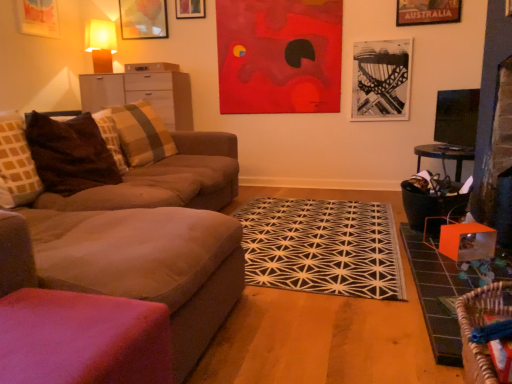
Question: Is there a large distance between matte wood cabinet at left and matte glass picture frame at upper left, which appears as the 2th picture frame when viewed from the left?

Choices:
 (A) no
 (B) yes

Answer: (A)

Question: Would you say matte wood cabinet at left is outside matte glass picture frame at upper left, which is the 3th picture frame from right to left?

Choices:
 (A) no
 (B) yes

Answer: (B)

Question: Is matte wood cabinet at left smaller than matte glass picture frame at upper left, which is the 3th picture frame from right to left?

Choices:
 (A) no
 (B) yes

Answer: (A)

Question: Can you see matte wood cabinet at left touching matte glass picture frame at upper left, which appears as the 2th picture frame when viewed from the left?

Choices:
 (A) yes
 (B) no

Answer: (B)

Question: Is matte wood cabinet at left facing towards matte glass picture frame at upper left, which is the 3th picture frame from right to left?

Choices:
 (A) no
 (B) yes

Answer: (A)

Question: Is woven wood swivel chair at lower right spatially inside matte white drawer at upper left, or outside of it?

Choices:
 (A) outside
 (B) inside

Answer: (A)

Question: Relative to matte white drawer at upper left, is woven wood swivel chair at lower right in front or behind?

Choices:
 (A) behind
 (B) front

Answer: (B)

Question: Looking at the image, does woven wood swivel chair at lower right seem bigger or smaller compared to matte white drawer at upper left?

Choices:
 (A) big
 (B) small

Answer: (B)

Question: From the image's perspective, relative to matte white drawer at upper left, is woven wood swivel chair at lower right above or below?

Choices:
 (A) below
 (B) above

Answer: (A)

Question: Is matte glass picture frame at upper left, which is the 3th picture frame from right to left, inside or outside of black geometric rug at center?

Choices:
 (A) inside
 (B) outside

Answer: (B)

Question: From the image's perspective, is matte glass picture frame at upper left, which is the 3th picture frame from right to left, positioned above or below black geometric rug at center?

Choices:
 (A) below
 (B) above

Answer: (B)

Question: Relative to black geometric rug at center, is matte glass picture frame at upper left, which appears as the 2th picture frame when viewed from the left, in front or behind?

Choices:
 (A) behind
 (B) front

Answer: (A)

Question: In terms of size, does matte glass picture frame at upper left, which appears as the 2th picture frame when viewed from the left, appear bigger or smaller than black geometric rug at center?

Choices:
 (A) big
 (B) small

Answer: (B)

Question: In terms of height, does matte orange lampshade at upper left look taller or shorter compared to black geometric rug at center?

Choices:
 (A) tall
 (B) short

Answer: (A)

Question: From the image's perspective, is matte orange lampshade at upper left above or below black geometric rug at center?

Choices:
 (A) above
 (B) below

Answer: (A)